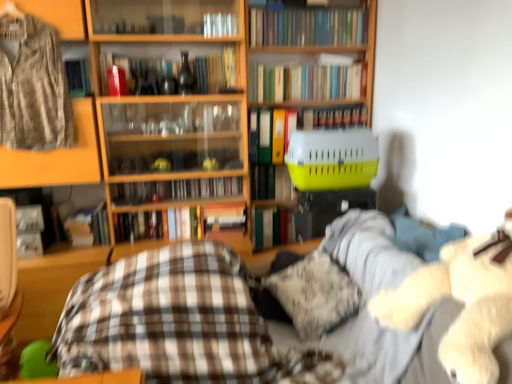
Question: Could you tell me if hardcover book at center, acting as the 5th book starting from the bottom, is facing hardcover books at center, which is the 8th book from top to bottom?

Choices:
 (A) yes
 (B) no

Answer: (B)

Question: From a real-world perspective, is hardcover book at center, acting as the 5th book starting from the bottom, below hardcover books at center, which is the 8th book from top to bottom?

Choices:
 (A) yes
 (B) no

Answer: (B)

Question: From the image's perspective, would you say hardcover book at center, which is the 6th book from top to bottom, is shown under hardcover books at center, which is the 8th book from top to bottom?

Choices:
 (A) yes
 (B) no

Answer: (B)

Question: Is hardcover book at center, acting as the 5th book starting from the bottom, to the right of hardcover books at center, placed as the 3th book when sorted from bottom to top, from the viewer's perspective?

Choices:
 (A) yes
 (B) no

Answer: (B)

Question: From a real-world perspective, is hardcover book at center, which is the 6th book from top to bottom, over hardcover books at center, which is the 8th book from top to bottom?

Choices:
 (A) no
 (B) yes

Answer: (B)

Question: Is hardcover book at center, which is the 6th book from top to bottom, facing away from hardcover books at center, placed as the 3th book when sorted from bottom to top?

Choices:
 (A) yes
 (B) no

Answer: (B)

Question: Is the surface of hardcover book at center, the fifth book in the top-to-bottom sequence, in direct contact with hardcover book at center, acting as the 10th book starting from the top?

Choices:
 (A) no
 (B) yes

Answer: (A)

Question: Does hardcover book at center, the 6th book when ordered from bottom to top, lie behind hardcover book at center, which is counted as the 1th book, starting from the bottom?

Choices:
 (A) no
 (B) yes

Answer: (B)

Question: Is hardcover book at center, the fifth book in the top-to-bottom sequence, turned away from hardcover book at center, which is counted as the 1th book, starting from the bottom?

Choices:
 (A) no
 (B) yes

Answer: (A)

Question: Considering the relative sizes of hardcover book at center, the 6th book when ordered from bottom to top, and hardcover book at center, which is counted as the 1th book, starting from the bottom, in the image provided, is hardcover book at center, the 6th book when ordered from bottom to top, thinner than hardcover book at center, which is counted as the 1th book, starting from the bottom,?

Choices:
 (A) yes
 (B) no

Answer: (A)

Question: From the image's perspective, is hardcover book at center, the fifth book in the top-to-bottom sequence, located beneath hardcover book at center, acting as the 10th book starting from the top?

Choices:
 (A) yes
 (B) no

Answer: (B)

Question: Does hardcover book at center, the 6th book when ordered from bottom to top, have a smaller size compared to hardcover book at center, which is counted as the 1th book, starting from the bottom?

Choices:
 (A) yes
 (B) no

Answer: (B)

Question: From a real-world perspective, is yellow plastic pet carrier at center physically above fluffy white teddy bear at right?

Choices:
 (A) no
 (B) yes

Answer: (B)